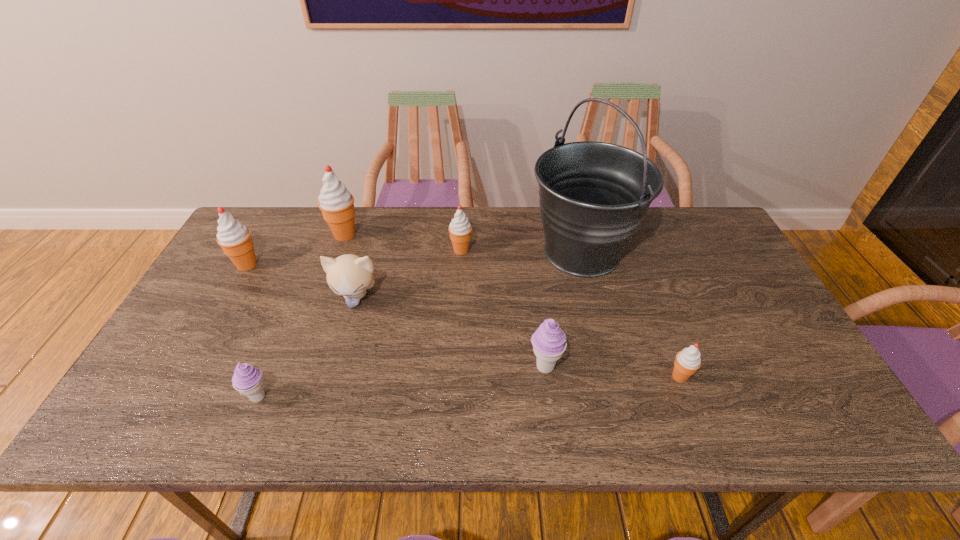
Locate which icecream is the sixth closest to the kitten. Please provide its 2D coordinates. Your answer should be formatted as a tuple, i.e. [(x, y)], where the tuple contains the x and y coordinates of a point satisfying the conditions above.

[(688, 361)]

Identify the location of icecream that stands as the closest to the leftmost object. The width and height of the screenshot is (960, 540). (336, 203).

This screenshot has height=540, width=960. In order to click on the third closest red icecream to the tallest object in this screenshot , I will do `click(336, 203)`.

Identify which red icecream is located as the fourth nearest to the tallest object. Please provide its 2D coordinates. Your answer should be formatted as a tuple, i.e. [(x, y)], where the tuple contains the x and y coordinates of a point satisfying the conditions above.

[(234, 238)]

I want to click on vacant space that satisfies the following two spatial constraints: 1. on the back side of the second smallest red icecream; 2. on the left side of the left purple icecream, so click(x=318, y=250).